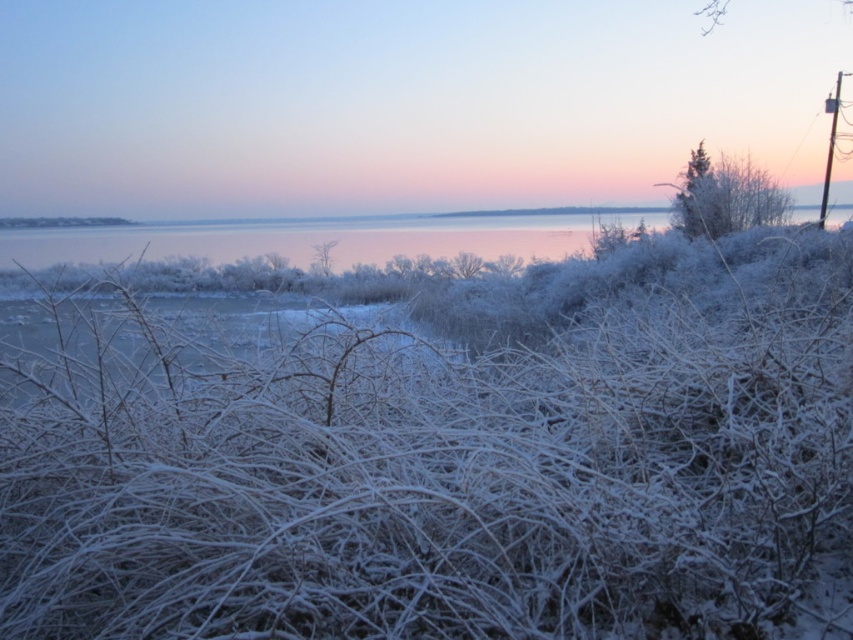
Question: Which of the following is the closest to the observer?

Choices:
 (A) (506, 397)
 (B) (418, 252)

Answer: (A)

Question: Is frosted white grass at center above silvery reflective water at center?

Choices:
 (A) yes
 (B) no

Answer: (B)

Question: Does frosted white grass at center have a smaller size compared to silvery reflective water at center?

Choices:
 (A) yes
 (B) no

Answer: (A)

Question: Where is frosted white grass at center located in relation to silvery reflective water at center in the image?

Choices:
 (A) left
 (B) right

Answer: (B)

Question: Among these points, which one is nearest to the camera?

Choices:
 (A) (132, 259)
 (B) (779, 230)

Answer: (B)